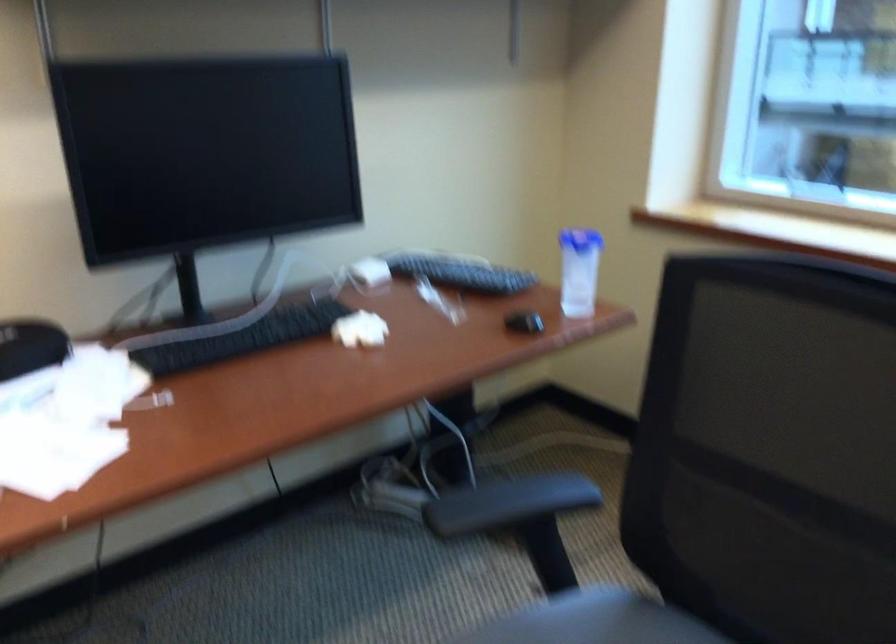
Locate an element on the screen. clear water bottle is located at coordinates (579, 270).